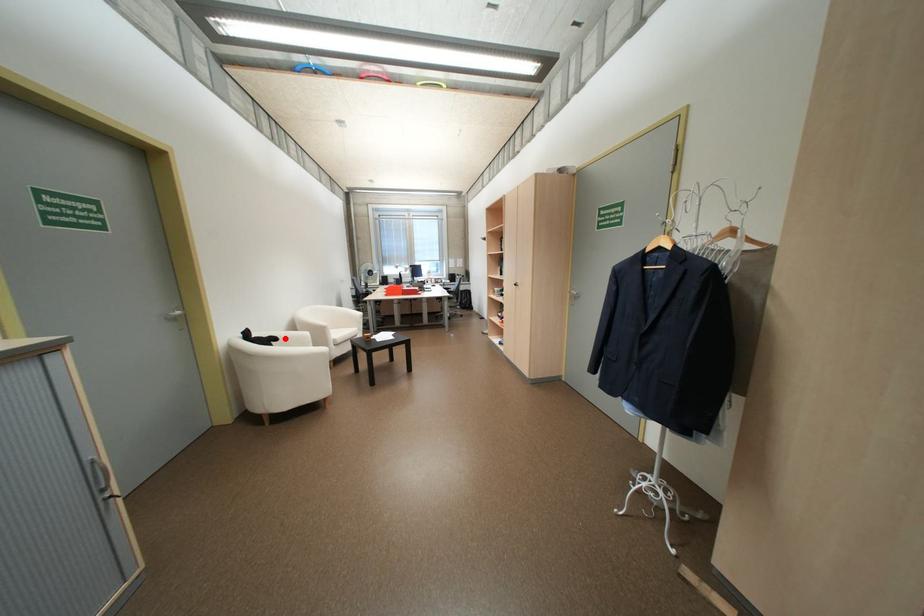
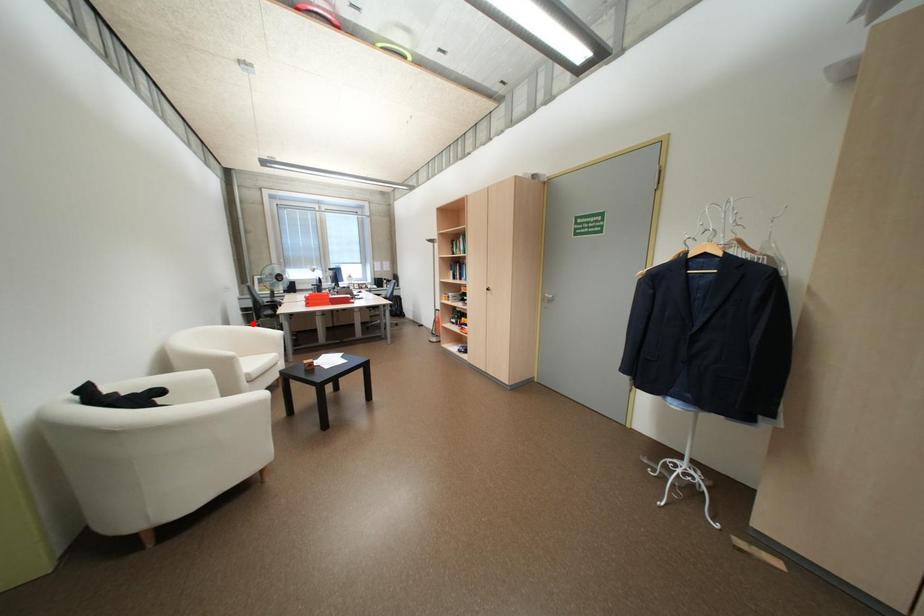
I am providing you with two images of the same scene from different viewpoints. A red point is marked on the first image and another point is marked on the second image. Do the highlighted points in image1 and image2 indicate the same real-world spot?

No